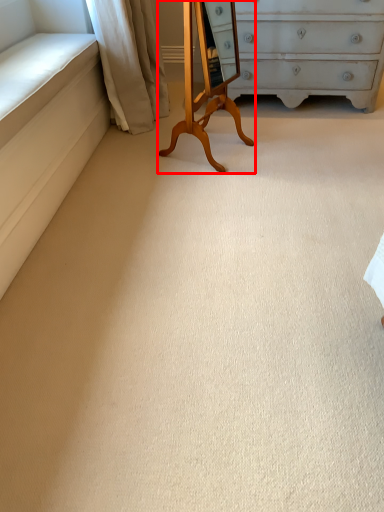
Question: Considering the relative positions of changing table (annotated by the red box) and curtain in the image provided, where is changing table (annotated by the red box) located with respect to the staircase?

Choices:
 (A) left
 (B) right

Answer: (B)